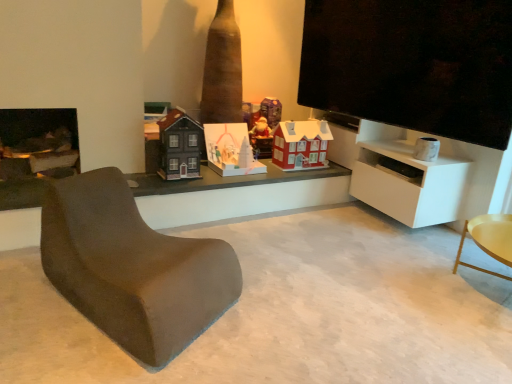
The width and height of the screenshot is (512, 384). I want to click on matte red house at center, the first toy positioned from the right, so click(x=301, y=145).

The width and height of the screenshot is (512, 384). In order to click on matte white paper house at center, acting as the second toy starting from the left in this screenshot , I will do `click(230, 150)`.

Is matte red house at center, acting as the 4th toy starting from the left, oriented away from white matte cabinet at right?

No, white matte cabinet at right is not at the back of matte red house at center, acting as the 4th toy starting from the left.

Can you confirm if matte red house at center, the first toy positioned from the right, is wider than white matte cabinet at right?

No.

Would you say matte red house at center, the first toy positioned from the right, is to the left or to the right of white matte cabinet at right in the picture?

matte red house at center, the first toy positioned from the right, is positioned on white matte cabinet at right's left side.

The image size is (512, 384). In the image, there is a matte red house at center, the first toy positioned from the right. What are the coordinates of `cabinetry below it (from the image's perspective)` in the screenshot? It's located at (408, 183).

Which of these two, matte white paper house at center, acting as the 3th toy starting from the right, or matte red house at center, the 2th toy in the right-to-left sequence, is wider?

Wider between the two is matte white paper house at center, acting as the 3th toy starting from the right.

Considering the relative sizes of matte white paper house at center, acting as the 3th toy starting from the right, and matte red house at center, the 2th toy in the right-to-left sequence, in the image provided, is matte white paper house at center, acting as the 3th toy starting from the right, taller than matte red house at center, the 2th toy in the right-to-left sequence,?

No, matte white paper house at center, acting as the 3th toy starting from the right, is not taller than matte red house at center, the 2th toy in the right-to-left sequence.

Is matte white paper house at center, acting as the 3th toy starting from the right, positioned with its back to matte red house at center, placed as the third toy when sorted from left to right?

That's not correct — matte white paper house at center, acting as the 3th toy starting from the right, is not looking away from matte red house at center, placed as the third toy when sorted from left to right.

Can you confirm if matte black house at center, positioned as the 4th toy in right-to-left order, is positioned to the right of matte white paper house at center, acting as the 3th toy starting from the right?

Incorrect, matte black house at center, positioned as the 4th toy in right-to-left order, is not on the right side of matte white paper house at center, acting as the 3th toy starting from the right.

Measure the distance between matte black house at center, positioned as the 4th toy in right-to-left order, and matte white paper house at center, acting as the 3th toy starting from the right.

14.44 inches.

From the image's perspective, which toy is the 1st one above the matte white paper house at center, acting as the second toy starting from the left? Please provide its 2D coordinates.

[(180, 146)]

Is matte brown chair at lower left turned away from matte red house at center, acting as the 4th toy starting from the left?

No, matte brown chair at lower left is not facing away from matte red house at center, acting as the 4th toy starting from the left.

From a real-world perspective, relative to matte red house at center, acting as the 4th toy starting from the left, is matte brown chair at lower left vertically above or below?

In terms of real-world spatial position, matte brown chair at lower left is below matte red house at center, acting as the 4th toy starting from the left.

Can you confirm if matte brown chair at lower left is positioned to the left of matte red house at center, acting as the 4th toy starting from the left?

Yes, matte brown chair at lower left is to the left of matte red house at center, acting as the 4th toy starting from the left.

Could white matte cabinet at right be considered to be inside matte black house at center, marked as the first toy in a left-to-right arrangement?

No.

Considering the relative sizes of matte black house at center, positioned as the 4th toy in right-to-left order, and white matte cabinet at right in the image provided, is matte black house at center, positioned as the 4th toy in right-to-left order, wider than white matte cabinet at right?

No.

The image size is (512, 384). What are the coordinates of `cabinetry behind the matte black house at center, positioned as the 4th toy in right-to-left order` in the screenshot? It's located at (408, 183).

Is matte black house at center, marked as the first toy in a left-to-right arrangement, far from white matte cabinet at right?

Yes, matte black house at center, marked as the first toy in a left-to-right arrangement, and white matte cabinet at right are quite far apart.

Could you tell me if matte black house at center, positioned as the 4th toy in right-to-left order, is facing matte red house at center, the first toy positioned from the right?

No, matte black house at center, positioned as the 4th toy in right-to-left order, is not turned towards matte red house at center, the first toy positioned from the right.

Is matte black house at center, marked as the first toy in a left-to-right arrangement, outside of matte red house at center, acting as the 4th toy starting from the left?

Yes, matte black house at center, marked as the first toy in a left-to-right arrangement, is located beyond the bounds of matte red house at center, acting as the 4th toy starting from the left.

How different are the orientations of matte black house at center, positioned as the 4th toy in right-to-left order, and matte red house at center, acting as the 4th toy starting from the left, in degrees?

The angle between the facing direction of matte black house at center, positioned as the 4th toy in right-to-left order, and the facing direction of matte red house at center, acting as the 4th toy starting from the left, is 0.0644 degrees.

Is matte black house at center, marked as the first toy in a left-to-right arrangement, positioned behind matte red house at center, the first toy positioned from the right?

No, matte black house at center, marked as the first toy in a left-to-right arrangement, is closer to the viewer.

Can you confirm if matte brown chair at lower left is wider than matte red house at center, the 2th toy in the right-to-left sequence?

Yes, matte brown chair at lower left is wider than matte red house at center, the 2th toy in the right-to-left sequence.

Would you consider matte brown chair at lower left to be distant from matte red house at center, placed as the third toy when sorted from left to right?

That's right, there is a large distance between matte brown chair at lower left and matte red house at center, placed as the third toy when sorted from left to right.

From a real-world perspective, is matte brown chair at lower left physically located above or below matte red house at center, placed as the third toy when sorted from left to right?

matte brown chair at lower left is situated lower than matte red house at center, placed as the third toy when sorted from left to right, in the real world.

Image resolution: width=512 pixels, height=384 pixels. I want to click on the 2nd toy behind the white matte cabinet at right, so click(x=301, y=145).

From a real-world perspective, count 3rd toys upward from the matte white paper house at center, acting as the 3th toy starting from the right, and point to it. Please provide its 2D coordinates.

[(265, 127)]

When comparing their distances from white matte cabinet at right, does matte red house at center, acting as the 4th toy starting from the left, or matte white paper house at center, acting as the second toy starting from the left, seem further?

matte white paper house at center, acting as the second toy starting from the left, is further to white matte cabinet at right.

When comparing their distances from matte brown chair at lower left, does matte white paper house at center, acting as the second toy starting from the left, or white matte cabinet at right seem closer?

Based on the image, matte white paper house at center, acting as the second toy starting from the left, appears to be nearer to matte brown chair at lower left.

Which object lies further to the anchor point matte white paper house at center, acting as the 3th toy starting from the right, matte brown chair at lower left or white matte cabinet at right?

matte brown chair at lower left is positioned further to the anchor matte white paper house at center, acting as the 3th toy starting from the right.

Estimate the real-world distances between objects in this image. Which object is further from matte red house at center, acting as the 4th toy starting from the left, matte white paper house at center, acting as the second toy starting from the left, or matte black house at center, positioned as the 4th toy in right-to-left order?

Based on the image, matte black house at center, positioned as the 4th toy in right-to-left order, appears to be further to matte red house at center, acting as the 4th toy starting from the left.

Based on their spatial positions, is matte red house at center, acting as the 4th toy starting from the left, or matte white paper house at center, acting as the second toy starting from the left, further from matte brown chair at lower left?

matte red house at center, acting as the 4th toy starting from the left.

From the image, which object appears to be nearer to matte red house at center, placed as the third toy when sorted from left to right, matte red house at center, acting as the 4th toy starting from the left, or matte black house at center, positioned as the 4th toy in right-to-left order?

matte red house at center, acting as the 4th toy starting from the left, is closer to matte red house at center, placed as the third toy when sorted from left to right.

Estimate the real-world distances between objects in this image. Which object is further from matte black house at center, positioned as the 4th toy in right-to-left order, matte red house at center, acting as the 4th toy starting from the left, or matte white paper house at center, acting as the second toy starting from the left?

matte red house at center, acting as the 4th toy starting from the left, is further to matte black house at center, positioned as the 4th toy in right-to-left order.

Estimate the real-world distances between objects in this image. Which object is further from white matte cabinet at right, matte black house at center, positioned as the 4th toy in right-to-left order, or matte white paper house at center, acting as the 3th toy starting from the right?

The object further to white matte cabinet at right is matte black house at center, positioned as the 4th toy in right-to-left order.

Image resolution: width=512 pixels, height=384 pixels. What are the coordinates of `toy between matte brown chair at lower left and matte white paper house at center, acting as the 3th toy starting from the right, along the z-axis` in the screenshot? It's located at (180, 146).

The height and width of the screenshot is (384, 512). I want to click on cabinetry between matte brown chair at lower left and matte red house at center, the first toy positioned from the right, in the front-back direction, so click(x=408, y=183).

Image resolution: width=512 pixels, height=384 pixels. Identify the location of toy between matte white paper house at center, acting as the 3th toy starting from the right, and matte red house at center, the 2th toy in the right-to-left sequence, along the z-axis. (301, 145).

Where is `toy located between matte red house at center, the 2th toy in the right-to-left sequence, and white matte cabinet at right in the left-right direction`? This screenshot has width=512, height=384. toy located between matte red house at center, the 2th toy in the right-to-left sequence, and white matte cabinet at right in the left-right direction is located at coordinates (301, 145).